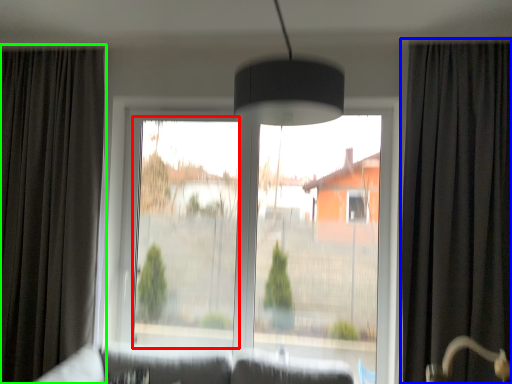
Question: Estimate the real-world distances between objects in this image. Which object is farther from window screen (highlighted by a red box), curtain (highlighted by a blue box) or curtain (highlighted by a green box)?

Choices:
 (A) curtain
 (B) curtain

Answer: (A)